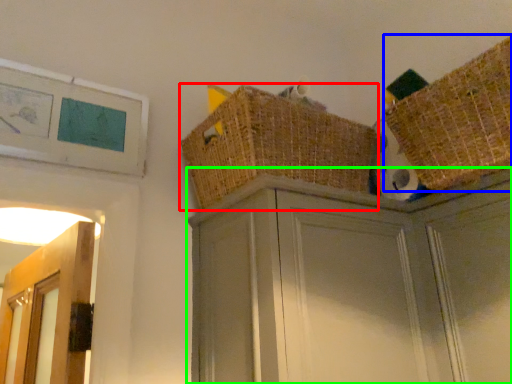
Question: Based on their relative distances, which object is farther from basket (highlighted by a red box)? Choose from basket (highlighted by a blue box) and cabinetry (highlighted by a green box).

Choices:
 (A) basket
 (B) cabinetry

Answer: (A)